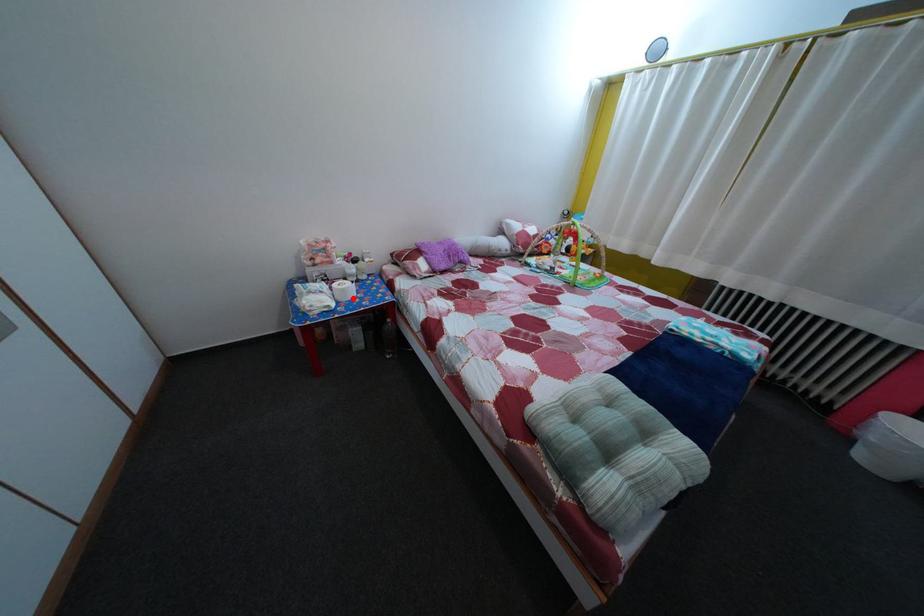
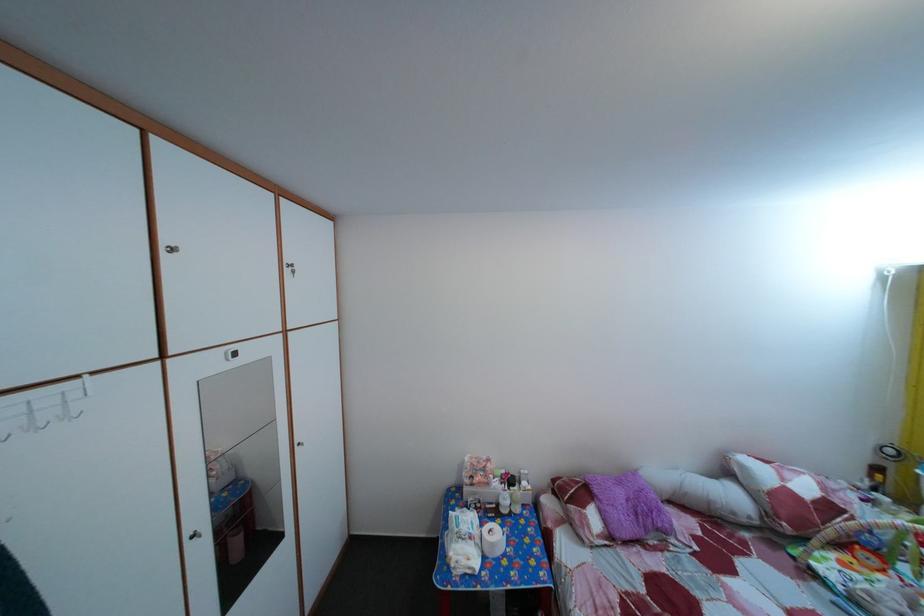
In the second image, find the point that corresponds to the highlighted location in the first image.

(502, 553)